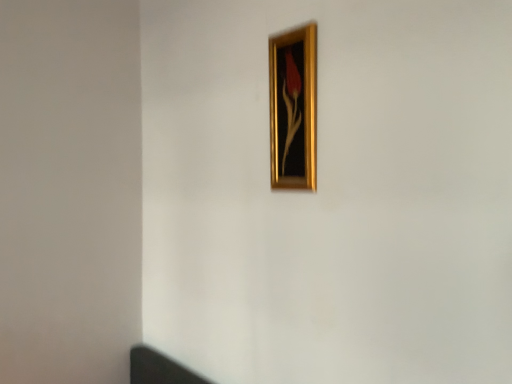
The height and width of the screenshot is (384, 512). What do you see at coordinates (293, 108) in the screenshot?
I see `gold metallic picture frame at center` at bounding box center [293, 108].

Find the location of a particular element. This screenshot has width=512, height=384. gold metallic picture frame at center is located at coordinates (293, 108).

Locate an element on the screen. gold metallic picture frame at center is located at coordinates (293, 108).